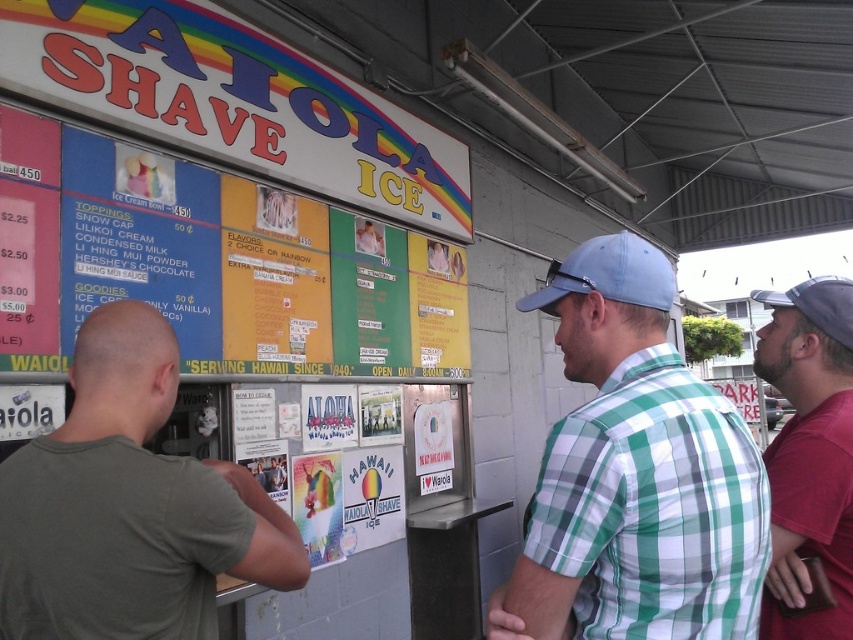
You are a customer at the Waiola Shave Ice stand and want to read the colorful paper menu at upper left while wearing the blue fabric baseball cap at center. Can you comfortably read the menu without moving your head?

The distance between the colorful paper menu at upper left and blue fabric baseball cap at center is 6.16 feet, which is a comfortable reading distance for most people. Yes, you can comfortably read the menu without moving your head.

You are a customer at the Waiola Shave Ice stand and want to order a Snow Cap with Lilikoi Cream. You notice a person wearing a dark red shirt at right and a blue fabric baseball cap at center. If you want to ask for the price of the toppings, which person should you approach based on their proximity to you?

Both the dark red shirt at right and the blue fabric baseball cap at center are staff members. Since they are 60.63 centimeters apart from each other, you can approach either one as they are both nearby and likely able to assist you with the price information.

What is the relationship between the width of the colorful paper menu at upper left and the blue fabric baseball cap at center?

The colorful paper menu at upper left is wider than the blue fabric baseball cap at center.